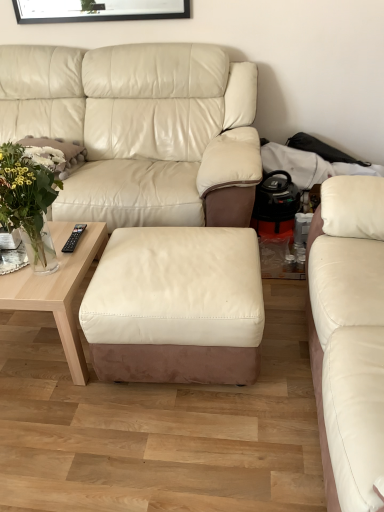
The image size is (384, 512). What are the coordinates of `free point above white leather ottoman at center (from a real-world perspective)` in the screenshot? It's located at (182, 260).